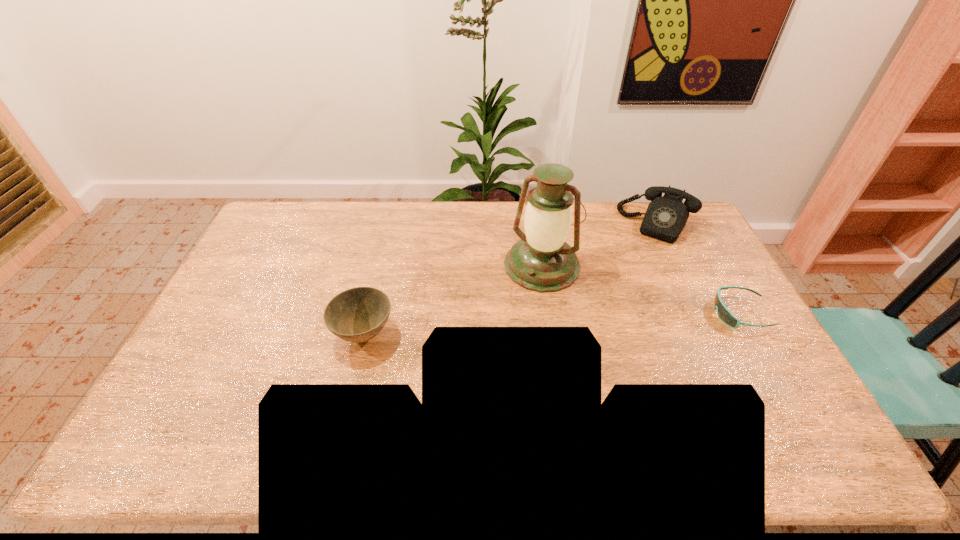
At what (x,y) coordinates should I click in order to perform the action: click on blank space at the far edge. Please return your answer as a coordinate pair (x, y). Looking at the image, I should click on [597, 220].

At what (x,y) coordinates should I click in order to perform the action: click on vacant area at the near edge of the desktop. Please return your answer as a coordinate pair (x, y). Looking at the image, I should click on (313, 413).

Find the location of a particular element. The height and width of the screenshot is (540, 960). vacant region at the right edge of the desktop is located at coordinates (703, 294).

What are the coordinates of `free space at the far right corner of the desktop` in the screenshot? It's located at (684, 227).

You are a GUI agent. You are given a task and a screenshot of the screen. Output one action in this format:
    pyautogui.click(x=<x>, y=<y>)
    Task: Click on the free space between the third shortest object and the third object from right to left
    
    Given the screenshot: What is the action you would take?
    [x=600, y=245]

What are the coordinates of `vacant area that lies between the sunglasses and the leftmost object` in the screenshot? It's located at (553, 324).

At what (x,y) coordinates should I click in order to perform the action: click on free space between the lantern and the sunglasses. Please return your answer as a coordinate pair (x, y). Looking at the image, I should click on (641, 289).

The width and height of the screenshot is (960, 540). I want to click on free space that is in between the third shortest object and the sunglasses, so click(x=699, y=268).

Locate an element on the screen. blank region between the lantern and the telephone is located at coordinates click(x=600, y=245).

Where is `free space between the sunglasses and the leftmost object`? The height and width of the screenshot is (540, 960). free space between the sunglasses and the leftmost object is located at coordinates (553, 324).